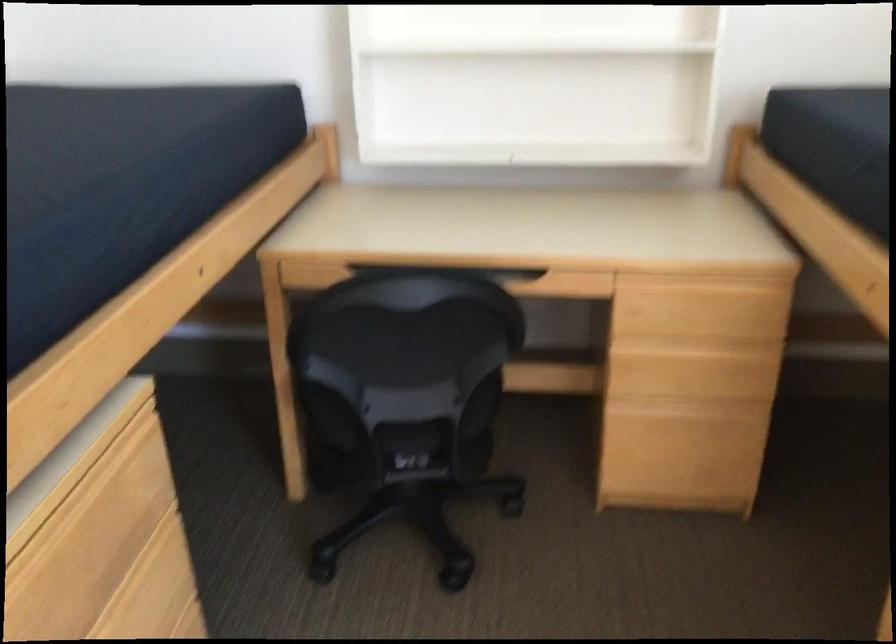
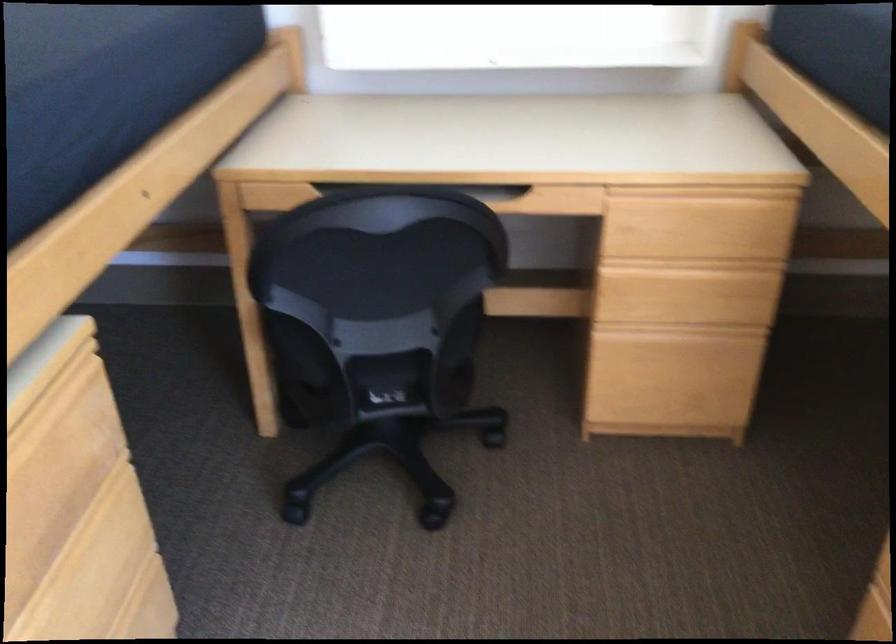
Question: The first image is from the beginning of the video and the second image is from the end. How did the camera likely rotate when shooting the video?

Choices:
 (A) Left
 (B) Right
 (C) Up
 (D) Down

Answer: (D)